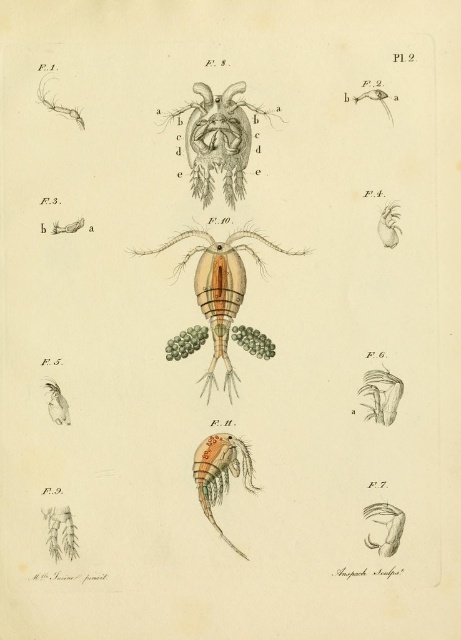
You are a researcher examining this scientific illustration. You notice the translucent beige heart at center and the matte white insect at lower left. Based on their positions, which object appears closer to the viewer?

The translucent beige heart at center appears closer to the viewer because it is positioned in front of the matte white insect at lower left.

You are examining a scientific illustration of crustaceans. You notice a translucent beige heart at center and a matte white insect at lower left. Which object is positioned to the right of the other?

The translucent beige heart at center is to the right of the matte white insect at lower left.